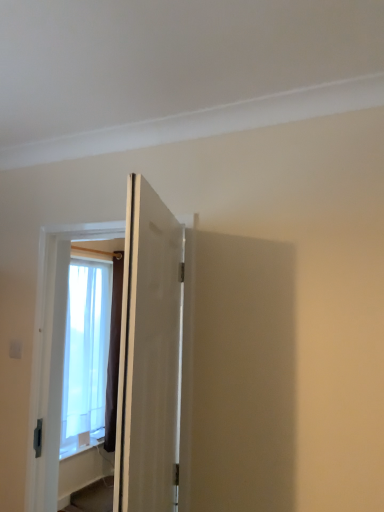
This screenshot has height=512, width=384. What do you see at coordinates (150, 356) in the screenshot?
I see `white matte door at center, placed as the 2th door when sorted from front to back` at bounding box center [150, 356].

Image resolution: width=384 pixels, height=512 pixels. I want to click on white matte door at center, marked as the 1th door in a back-to-front arrangement, so click(x=150, y=356).

What do you see at coordinates (149, 355) in the screenshot? The image size is (384, 512). I see `matte white door at center, which appears as the second door when viewed from the back` at bounding box center [149, 355].

At what (x,y) coordinates should I click in order to perform the action: click on matte white door at center, which appears as the first door when viewed from the front. Please return your answer as a coordinate pair (x, y). The width and height of the screenshot is (384, 512). Looking at the image, I should click on 149,355.

You are a GUI agent. You are given a task and a screenshot of the screen. Output one action in this format:
    pyautogui.click(x=<x>, y=<y>)
    Task: Click on the translucent fabric window at left
    
    Given the screenshot: What is the action you would take?
    pyautogui.click(x=86, y=353)

Is translucent fabric window at left inside white matte door at center, placed as the 2th door when sorted from front to back?

Actually, translucent fabric window at left is outside white matte door at center, placed as the 2th door when sorted from front to back.

Is the surface of white matte door at center, placed as the 2th door when sorted from front to back, in direct contact with translucent fabric window at left?

No, white matte door at center, placed as the 2th door when sorted from front to back, is not next to translucent fabric window at left.

Is white matte door at center, placed as the 2th door when sorted from front to back, taller or shorter than translucent fabric window at left?

Clearly, white matte door at center, placed as the 2th door when sorted from front to back, is shorter compared to translucent fabric window at left.

Is white matte door at center, placed as the 2th door when sorted from front to back, in contact with matte white door at center, which appears as the first door when viewed from the front?

Absolutely, white matte door at center, placed as the 2th door when sorted from front to back, is next to and touching matte white door at center, which appears as the first door when viewed from the front.

From the image's perspective, is white matte door at center, placed as the 2th door when sorted from front to back, beneath matte white door at center, which appears as the second door when viewed from the back?

Correct, white matte door at center, placed as the 2th door when sorted from front to back, appears lower than matte white door at center, which appears as the second door when viewed from the back, in the image.

How different are the orientations of white matte door at center, placed as the 2th door when sorted from front to back, and matte white door at center, which appears as the first door when viewed from the front, in degrees?

white matte door at center, placed as the 2th door when sorted from front to back, and matte white door at center, which appears as the first door when viewed from the front, are facing 69.4 degrees away from each other.

Which object is positioned more to the left, white matte door at center, marked as the 1th door in a back-to-front arrangement, or matte white door at center, which appears as the first door when viewed from the front?

white matte door at center, marked as the 1th door in a back-to-front arrangement.

What's the angular difference between matte white door at center, which appears as the second door when viewed from the back, and translucent fabric window at left's facing directions?

matte white door at center, which appears as the second door when viewed from the back, and translucent fabric window at left are facing 158 degrees away from each other.

Is matte white door at center, which appears as the second door when viewed from the back, positioned with its back to translucent fabric window at left?

That's not correct — matte white door at center, which appears as the second door when viewed from the back, is not looking away from translucent fabric window at left.

Are matte white door at center, which appears as the second door when viewed from the back, and translucent fabric window at left far apart?

matte white door at center, which appears as the second door when viewed from the back, is far away from translucent fabric window at left.

Consider the image. Is translucent fabric window at left located within matte white door at center, which appears as the first door when viewed from the front?

Actually, translucent fabric window at left is outside matte white door at center, which appears as the first door when viewed from the front.

Is matte white door at center, which appears as the second door when viewed from the back, oriented away from white matte door at center, marked as the 1th door in a back-to-front arrangement?

No, white matte door at center, marked as the 1th door in a back-to-front arrangement, is not at the back of matte white door at center, which appears as the second door when viewed from the back.

Between matte white door at center, which appears as the second door when viewed from the back, and white matte door at center, placed as the 2th door when sorted from front to back, which one appears on the right side from the viewer's perspective?

matte white door at center, which appears as the second door when viewed from the back, is more to the right.

From their relative heights in the image, would you say matte white door at center, which appears as the second door when viewed from the back, is taller or shorter than white matte door at center, marked as the 1th door in a back-to-front arrangement?

matte white door at center, which appears as the second door when viewed from the back, is shorter than white matte door at center, marked as the 1th door in a back-to-front arrangement.

Is translucent fabric window at left looking in the opposite direction of matte white door at center, which appears as the second door when viewed from the back?

No, matte white door at center, which appears as the second door when viewed from the back, is not at the back of translucent fabric window at left.

How different are the orientations of translucent fabric window at left and matte white door at center, which appears as the second door when viewed from the back, in degrees?

The angle between the facing direction of translucent fabric window at left and the facing direction of matte white door at center, which appears as the second door when viewed from the back, is 158 degrees.

In terms of height, does translucent fabric window at left look taller or shorter compared to matte white door at center, which appears as the second door when viewed from the back?

translucent fabric window at left is taller than matte white door at center, which appears as the second door when viewed from the back.

Is matte white door at center, which appears as the first door when viewed from the front, completely or partially inside translucent fabric window at left?

Definitely not — matte white door at center, which appears as the first door when viewed from the front, is not inside translucent fabric window at left.

How far apart are translucent fabric window at left and white matte door at center, marked as the 1th door in a back-to-front arrangement?

They are 8.17 feet apart.

Looking at this image, can you confirm if translucent fabric window at left is bigger than white matte door at center, placed as the 2th door when sorted from front to back?

Incorrect, translucent fabric window at left is not larger than white matte door at center, placed as the 2th door when sorted from front to back.

Between translucent fabric window at left and white matte door at center, marked as the 1th door in a back-to-front arrangement, which one appears on the left side from the viewer's perspective?

translucent fabric window at left is more to the left.

Find the location of a particular element. The width and height of the screenshot is (384, 512). window that appears behind the white matte door at center, placed as the 2th door when sorted from front to back is located at coordinates (86, 353).

Where is `door that is above the white matte door at center, marked as the 1th door in a back-to-front arrangement (from a real-world perspective)`? This screenshot has width=384, height=512. door that is above the white matte door at center, marked as the 1th door in a back-to-front arrangement (from a real-world perspective) is located at coordinates (149, 355).

From the image, which object appears to be farther from translucent fabric window at left, matte white door at center, which appears as the first door when viewed from the front, or white matte door at center, placed as the 2th door when sorted from front to back?

matte white door at center, which appears as the first door when viewed from the front, is further to translucent fabric window at left.

Considering their positions, is matte white door at center, which appears as the second door when viewed from the back, positioned closer to white matte door at center, placed as the 2th door when sorted from front to back, than translucent fabric window at left?

matte white door at center, which appears as the second door when viewed from the back, is closer to white matte door at center, placed as the 2th door when sorted from front to back.

From the image, which object appears to be nearer to matte white door at center, which appears as the second door when viewed from the back, translucent fabric window at left or white matte door at center, marked as the 1th door in a back-to-front arrangement?

white matte door at center, marked as the 1th door in a back-to-front arrangement, lies closer to matte white door at center, which appears as the second door when viewed from the back, than the other object.

When comparing their distances from white matte door at center, placed as the 2th door when sorted from front to back, does translucent fabric window at left or matte white door at center, which appears as the second door when viewed from the back, seem further?

Based on the image, translucent fabric window at left appears to be further to white matte door at center, placed as the 2th door when sorted from front to back.

Which object lies further to the anchor point translucent fabric window at left, white matte door at center, marked as the 1th door in a back-to-front arrangement, or matte white door at center, which appears as the second door when viewed from the back?

matte white door at center, which appears as the second door when viewed from the back.

When comparing their distances from matte white door at center, which appears as the first door when viewed from the front, does white matte door at center, marked as the 1th door in a back-to-front arrangement, or translucent fabric window at left seem closer?

white matte door at center, marked as the 1th door in a back-to-front arrangement, is positioned closer to the anchor matte white door at center, which appears as the first door when viewed from the front.

In order to click on door positioned between matte white door at center, which appears as the second door when viewed from the back, and translucent fabric window at left from near to far in this screenshot , I will do `click(150, 356)`.